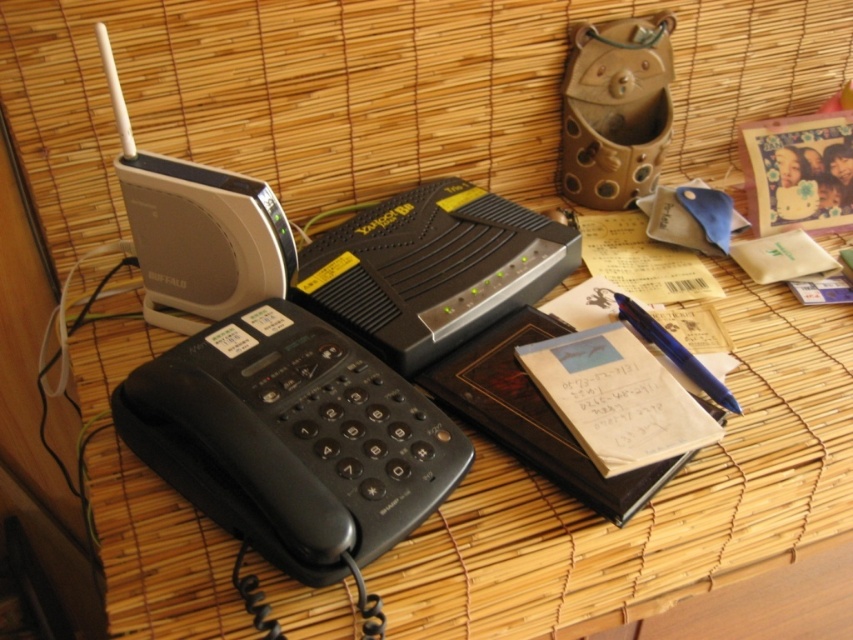
You are holding a 50 cm long ruler and want to measure the distance between yourself and the black plastic phone at lower left. Can you reach it without moving your hand?

The distance between the black plastic phone at lower left and the camera is 50.24 centimeters. Since the ruler is 50 cm long, you cannot quite reach the full distance and would need to move your hand slightly forward to measure it completely.

Based on the photo, you are trying to reach the point at coordinates point (x=328, y=413) and point (x=653, y=321) on the bamboo mat workspace. Which point is closer to you?

Point (x=328, y=413) is in front of point (x=653, y=321), so it is closer to you.